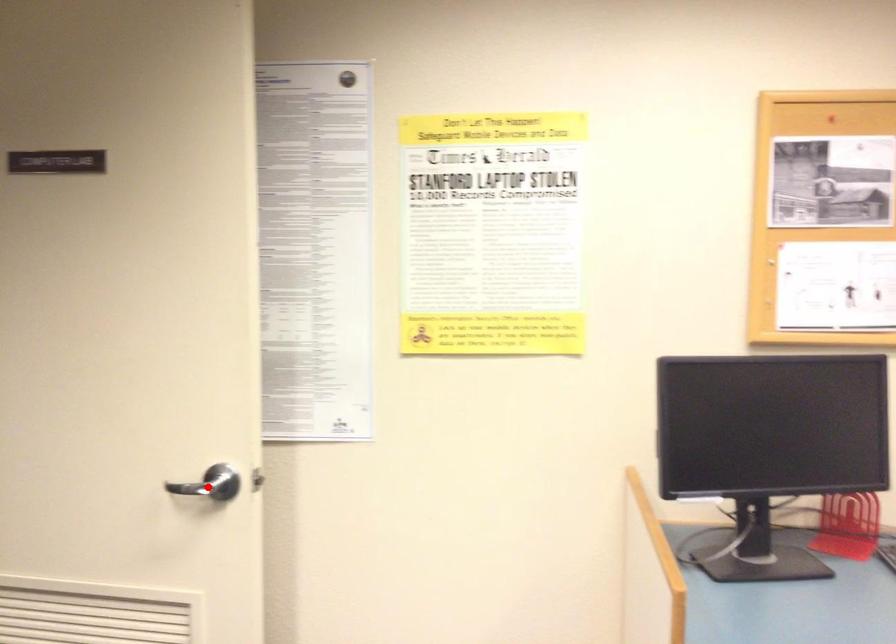
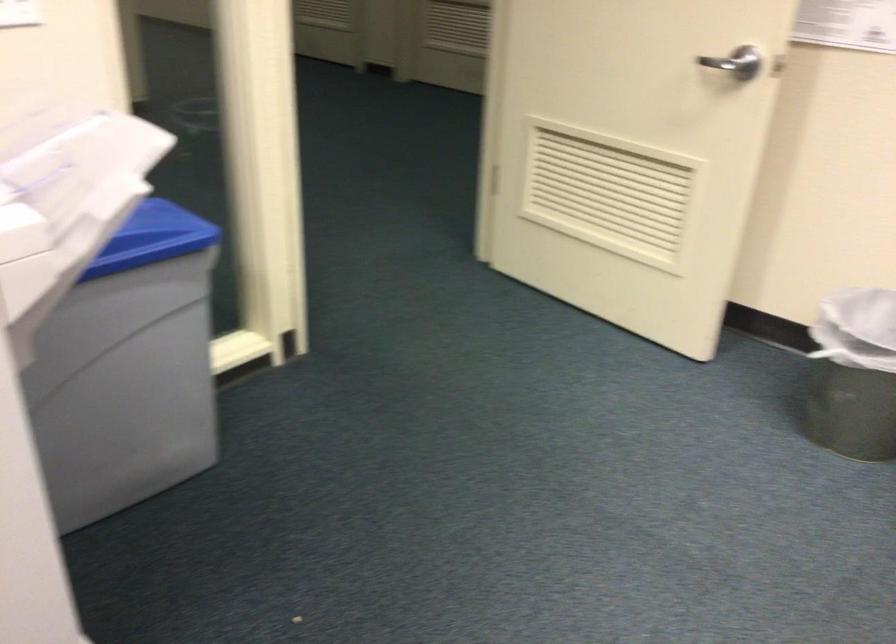
Question: I am providing you with two images of the same scene from different viewpoints. Given a red point in image1, look at the same physical point in image2. Is it:

Choices:
 (A) Closer to the viewpoint
 (B) Farther from the viewpoint

Answer: (B)